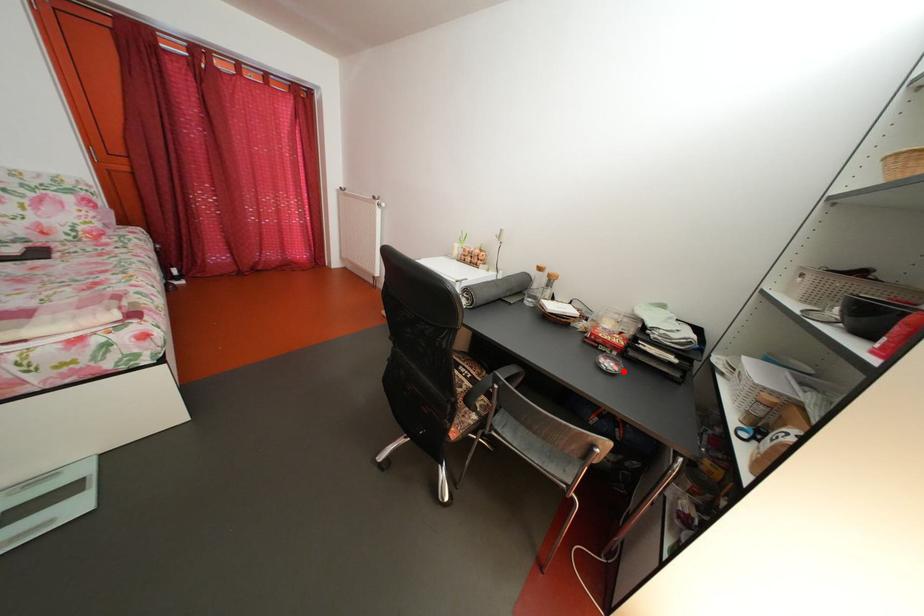
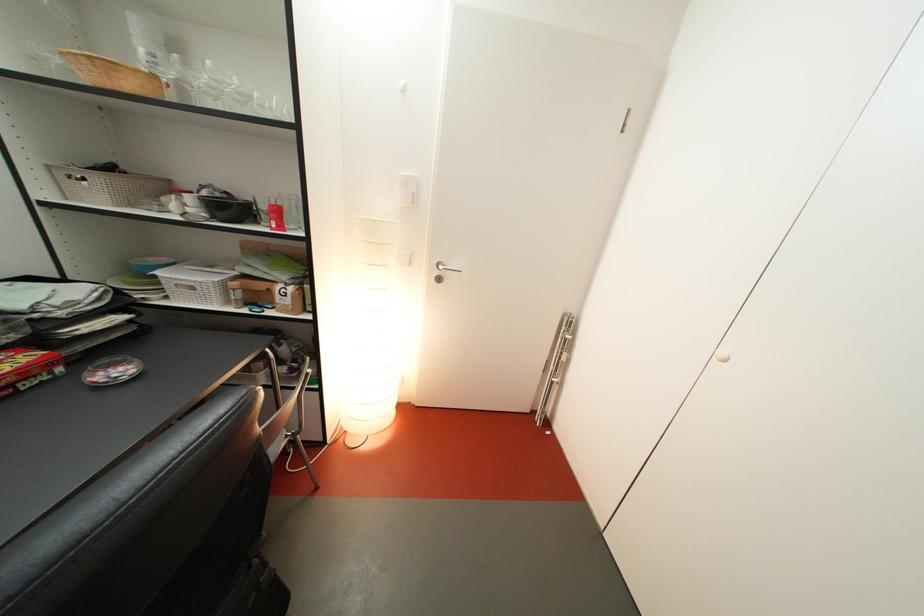
In the second image, find the point that corresponds to the highlighted location in the first image.

(131, 376)